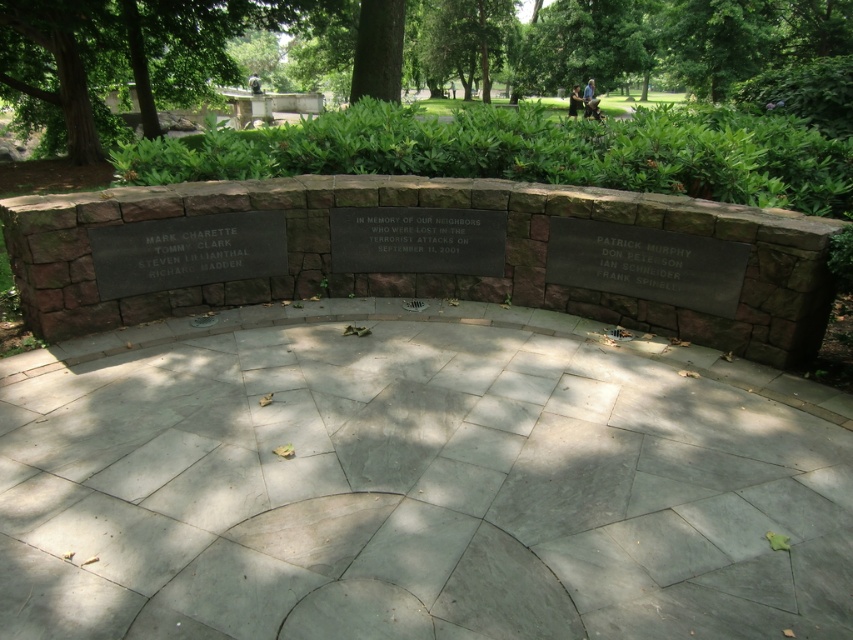
Question: Which is farther from the black polished stone plaque at right?

Choices:
 (A) green leafy tree at upper left
 (B) black polished stone plaque at center

Answer: (A)

Question: Is green leafy tree at upper left positioned behind black polished stone plaque at center?

Choices:
 (A) yes
 (B) no

Answer: (A)

Question: Which point is closer to the camera?

Choices:
 (A) black stone plaque at center
 (B) black polished stone plaque at right
 (C) black polished stone plaque at center
 (D) green leafy tree at upper left

Answer: (B)

Question: Observing the image, what is the correct spatial positioning of black stone plaque at center in reference to black polished stone plaque at right?

Choices:
 (A) above
 (B) below

Answer: (A)

Question: Considering the real-world distances, which object is closest to the green leafy tree at upper left?

Choices:
 (A) black polished stone plaque at center
 (B) black stone plaque at center

Answer: (A)

Question: Can you confirm if black polished stone plaque at center is wider than black polished stone plaque at right?

Choices:
 (A) yes
 (B) no

Answer: (A)